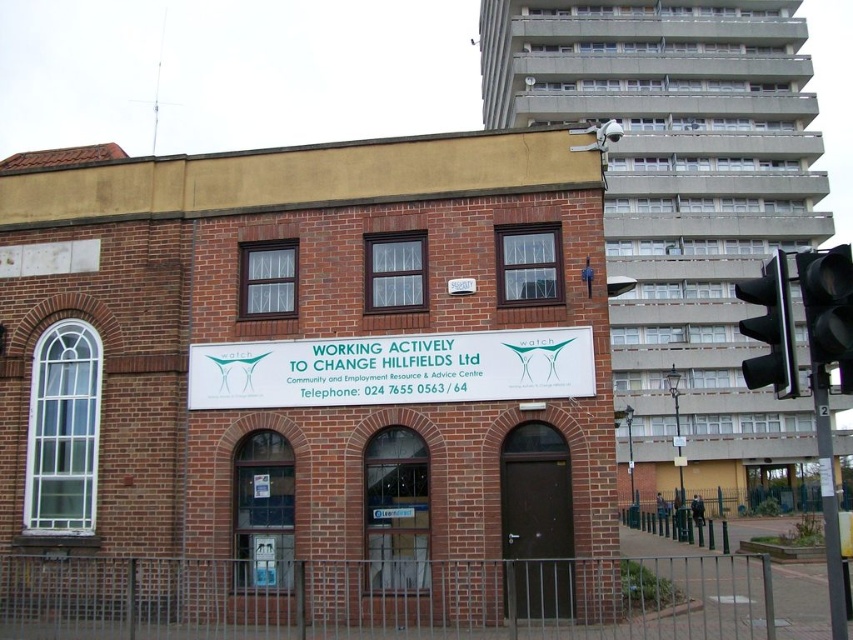
Question: Can you confirm if white plastic sign at center is positioned below black plastic traffic light at right?

Choices:
 (A) yes
 (B) no

Answer: (A)

Question: Can you confirm if white plastic sign at center is positioned to the right of black metal traffic light at right?

Choices:
 (A) no
 (B) yes

Answer: (A)

Question: Does white plastic sign at center appear over black metal traffic light at right?

Choices:
 (A) yes
 (B) no

Answer: (A)

Question: Estimate the real-world distances between objects in this image. Which object is farther from the black metal traffic light at right?

Choices:
 (A) black plastic traffic light at right
 (B) white plastic sign at center

Answer: (A)

Question: Which of these objects is positioned closest to the white plastic sign at center?

Choices:
 (A) black plastic traffic light at right
 (B) black metal traffic light at right

Answer: (B)

Question: Which object is closer to the camera taking this photo?

Choices:
 (A) black plastic traffic light at right
 (B) white plastic sign at center

Answer: (A)